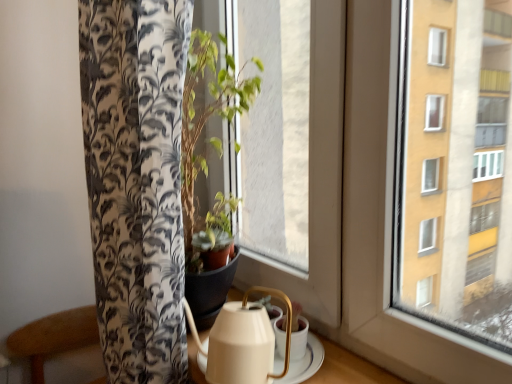
Question: Is transparent glass window at center not inside white ceramic tea set at lower center?

Choices:
 (A) yes
 (B) no

Answer: (A)

Question: Considering the relative sizes of transparent glass window at center and white ceramic tea set at lower center in the image provided, is transparent glass window at center taller than white ceramic tea set at lower center?

Choices:
 (A) no
 (B) yes

Answer: (B)

Question: Is transparent glass window at center not near white ceramic tea set at lower center?

Choices:
 (A) no
 (B) yes

Answer: (A)

Question: Does transparent glass window at center touch white ceramic tea set at lower center?

Choices:
 (A) no
 (B) yes

Answer: (A)

Question: Considering the relative sizes of transparent glass window at center and white ceramic tea set at lower center in the image provided, is transparent glass window at center smaller than white ceramic tea set at lower center?

Choices:
 (A) no
 (B) yes

Answer: (A)

Question: Does transparent glass window at center have a lesser height compared to white ceramic tea set at lower center?

Choices:
 (A) no
 (B) yes

Answer: (A)

Question: Considering the relative sizes of white ceramic tea set at lower center and transparent glass window at center in the image provided, is white ceramic tea set at lower center taller than transparent glass window at center?

Choices:
 (A) yes
 (B) no

Answer: (B)

Question: Are white ceramic tea set at lower center and transparent glass window at center beside each other?

Choices:
 (A) no
 (B) yes

Answer: (A)

Question: Is white ceramic tea set at lower center in front of transparent glass window at center?

Choices:
 (A) no
 (B) yes

Answer: (B)

Question: Is white ceramic tea set at lower center wider than transparent glass window at center?

Choices:
 (A) no
 (B) yes

Answer: (B)

Question: Is white ceramic tea set at lower center thinner than transparent glass window at center?

Choices:
 (A) no
 (B) yes

Answer: (A)

Question: Does white ceramic tea set at lower center appear on the left side of transparent glass window at center?

Choices:
 (A) yes
 (B) no

Answer: (B)

Question: In terms of size, does white ceramic tea set at lower center appear bigger or smaller than transparent glass window at center?

Choices:
 (A) small
 (B) big

Answer: (A)